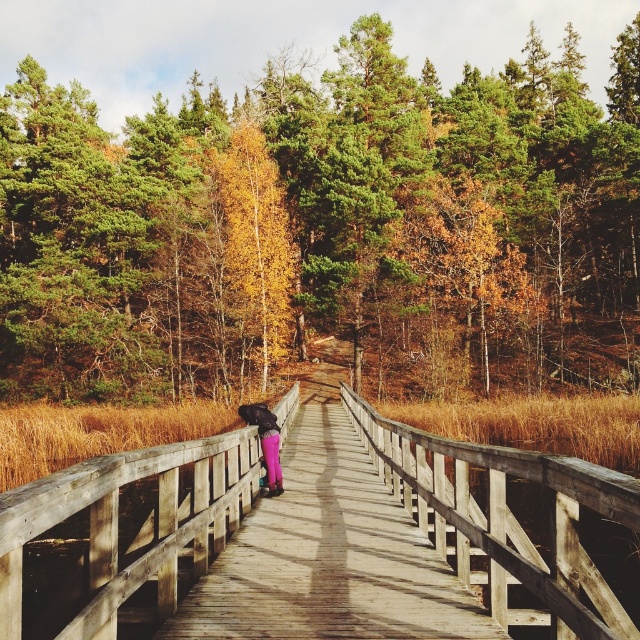
You are a hiker who wants to cross the wooden bridge at center while wearing purple matte pants at center. Will your pants get caught in the bridge structure?

The wooden bridge at center is taller than purple matte pants at center, so your pants will not get caught in the bridge structure.

You are standing on the boardwalk and notice the green textured trees at upper center and the purple matte pants at center. Which object is positioned to the right of the other?

The green textured trees at upper center is to the right of purple matte pants at center.

You are an observer standing on the wooden boardwalk and notice the green textured trees at upper center and the purple matte pants at center. Which object appears bigger in the scene?

The green textured trees at upper center appears larger than the purple matte pants at center in the scene.